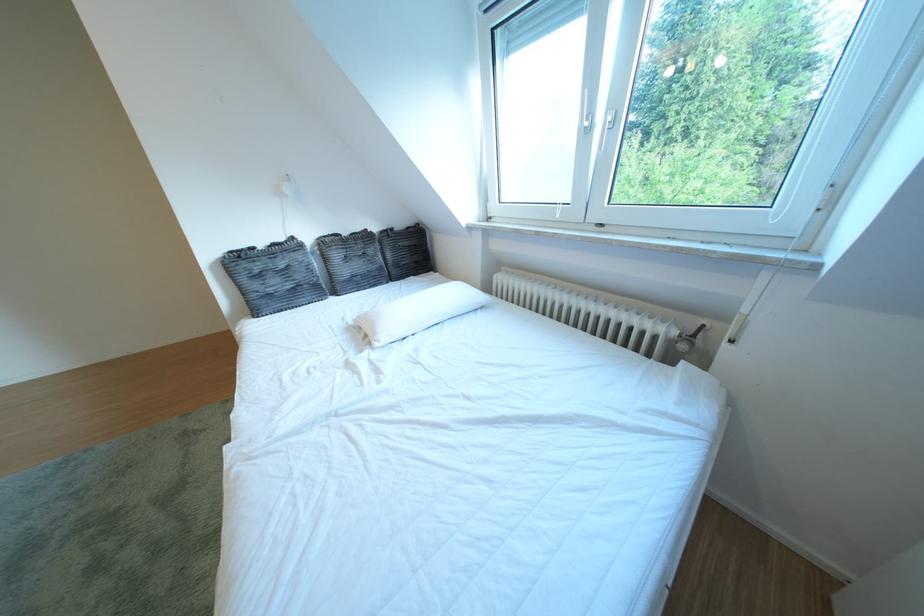
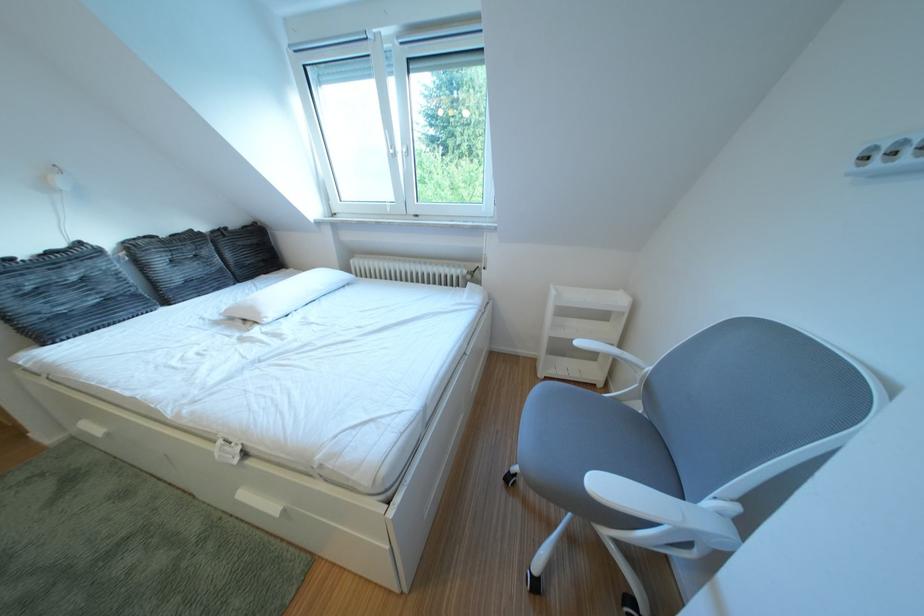
Find the pixel in the second image that matches point 414,229 in the first image.

(247, 228)